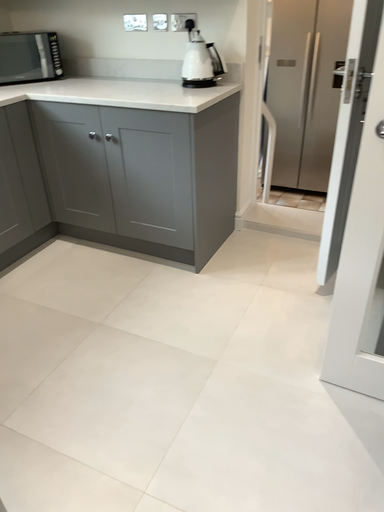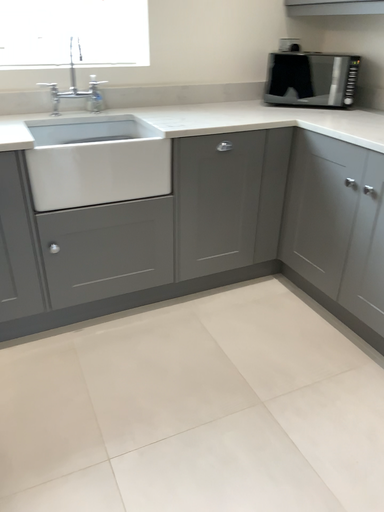
Question: Which way did the camera rotate in the video?

Choices:
 (A) rotated downward
 (B) rotated upward

Answer: (B)